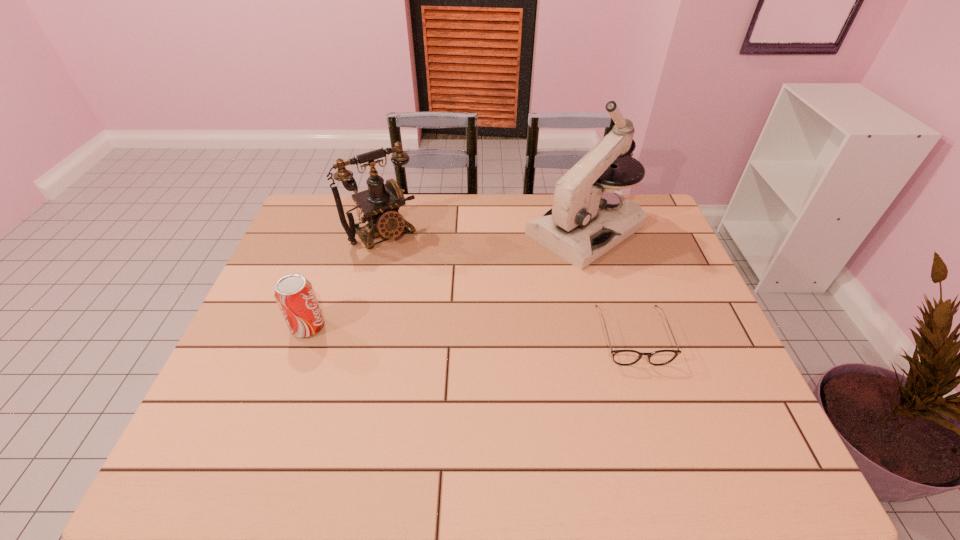
I want to click on free area in between the tallest object and the shortest object, so click(x=609, y=284).

At what (x,y) coordinates should I click in order to perform the action: click on vacant area that lies between the shortest object and the soda can. Please return your answer as a coordinate pair (x, y). Image resolution: width=960 pixels, height=540 pixels. Looking at the image, I should click on (470, 332).

Identify the location of free space between the shortest object and the soda can. (470, 332).

The image size is (960, 540). I want to click on free area in between the telephone and the microscope, so click(485, 231).

Choose which object is the nearest neighbor to the shortest object. Please provide its 2D coordinates. Your answer should be formatted as a tuple, i.e. [(x, y)], where the tuple contains the x and y coordinates of a point satisfying the conditions above.

[(588, 218)]

Choose which object is the second nearest neighbor to the second tallest object. Please provide its 2D coordinates. Your answer should be formatted as a tuple, i.e. [(x, y)], where the tuple contains the x and y coordinates of a point satisfying the conditions above.

[(588, 218)]

Where is `free region that satisfies the following two spatial constraints: 1. on the back side of the tallest object; 2. on the right side of the telephone`? The width and height of the screenshot is (960, 540). free region that satisfies the following two spatial constraints: 1. on the back side of the tallest object; 2. on the right side of the telephone is located at coordinates (384, 230).